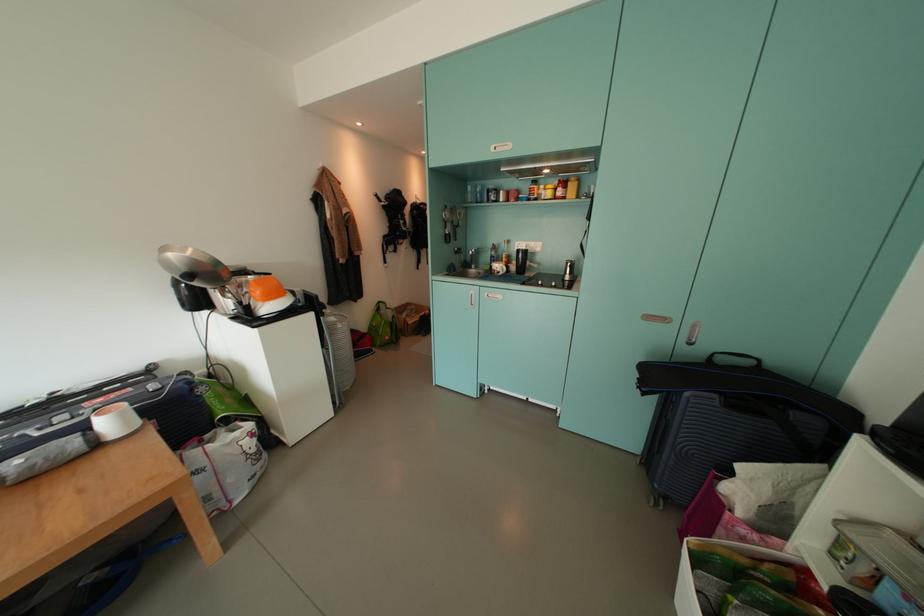
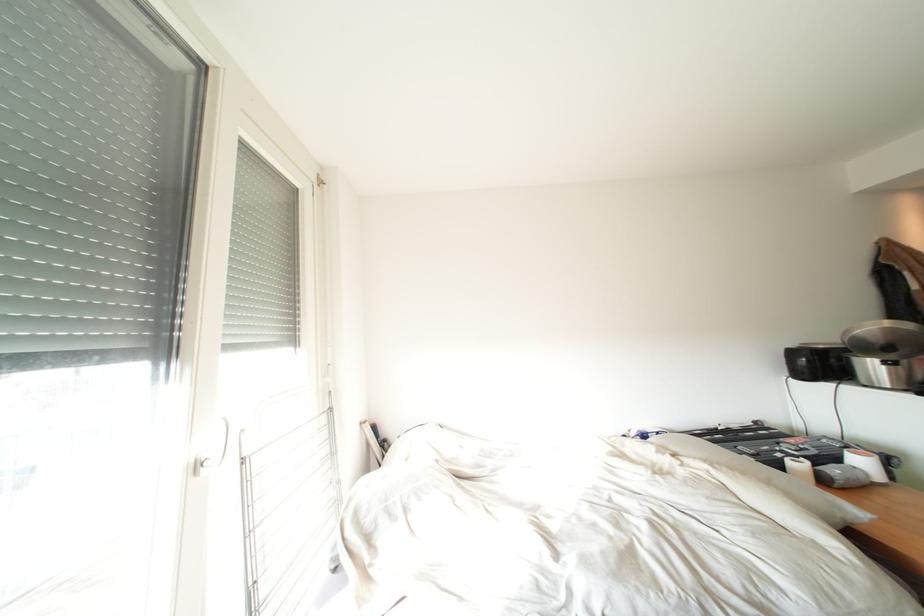
Find the pixel in the second image that matches [91,429] in the first image.

(845, 463)